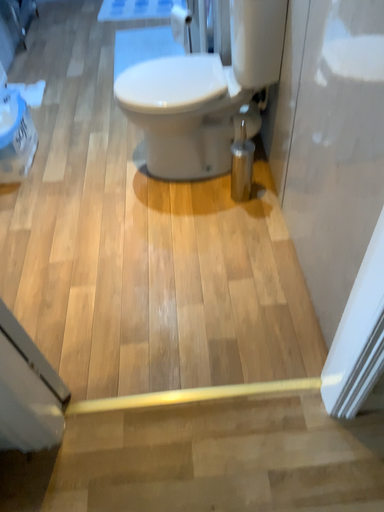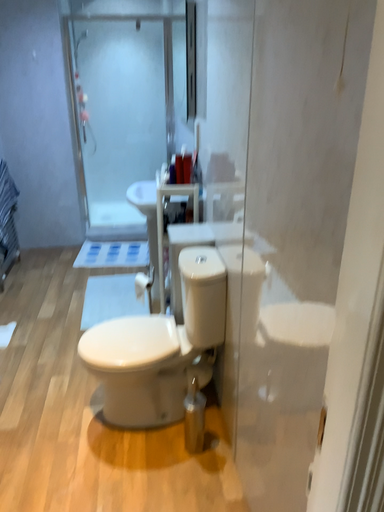
Question: How did the camera likely rotate when shooting the video?

Choices:
 (A) rotated upward
 (B) rotated downward

Answer: (A)